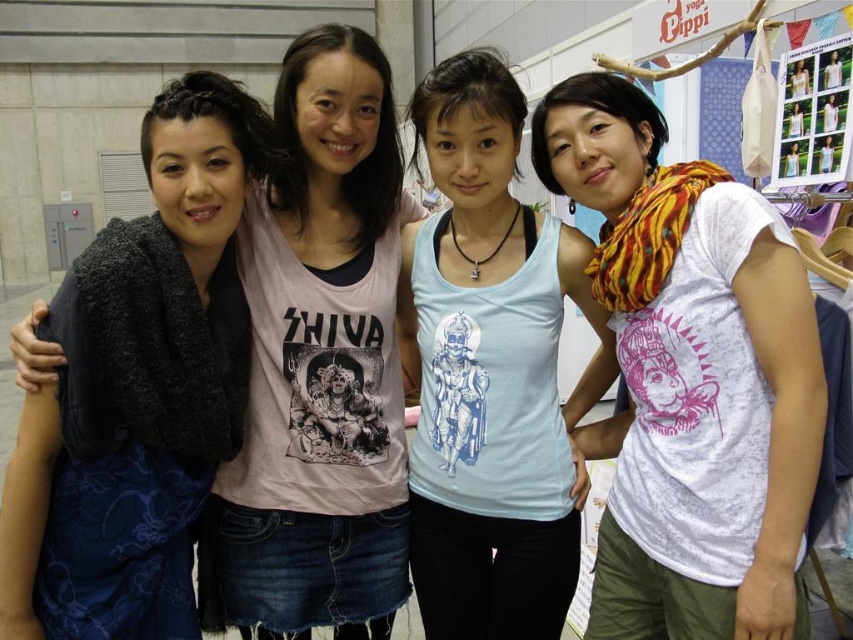
Between white printed t-shirt at right and matte black scarf at left, which one appears on the right side from the viewer's perspective?

Positioned to the right is white printed t-shirt at right.

Does point (639, 352) come farther from viewer compared to point (267, 284)?

No.

Locate an element on the screen. Image resolution: width=853 pixels, height=640 pixels. white printed t-shirt at right is located at coordinates (689, 378).

The width and height of the screenshot is (853, 640). Describe the element at coordinates (320, 364) in the screenshot. I see `matte black scarf at left` at that location.

Who is positioned more to the left, matte black scarf at left or light blue tank top at center?

matte black scarf at left is more to the left.

Locate an element on the screen. The image size is (853, 640). matte black scarf at left is located at coordinates (320, 364).

Where is `matte black scarf at left`? The image size is (853, 640). matte black scarf at left is located at coordinates (320, 364).

Between white printed t-shirt at right and light blue tank top at center, which one has less height?

Standing shorter between the two is white printed t-shirt at right.

Which is in front, point (683, 272) or point (428, 580)?

Positioned in front is point (683, 272).

Locate an element on the screen. white printed t-shirt at right is located at coordinates coord(689,378).